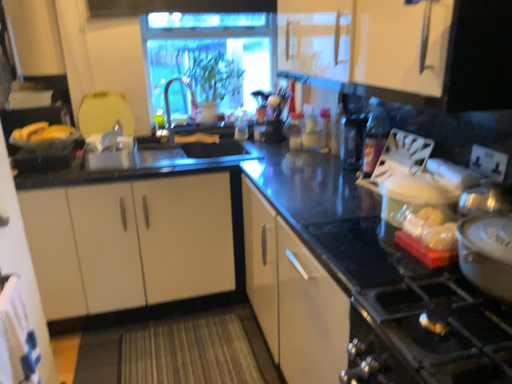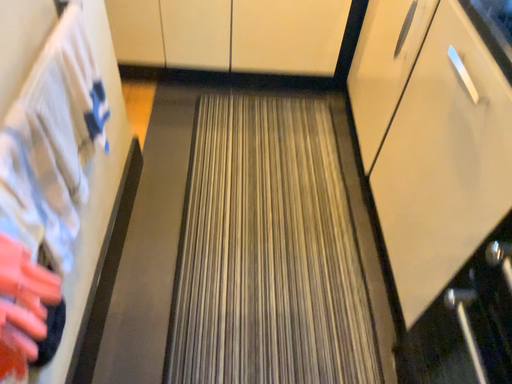
Question: How did the camera likely rotate when shooting the video?

Choices:
 (A) rotated downward
 (B) rotated upward

Answer: (A)